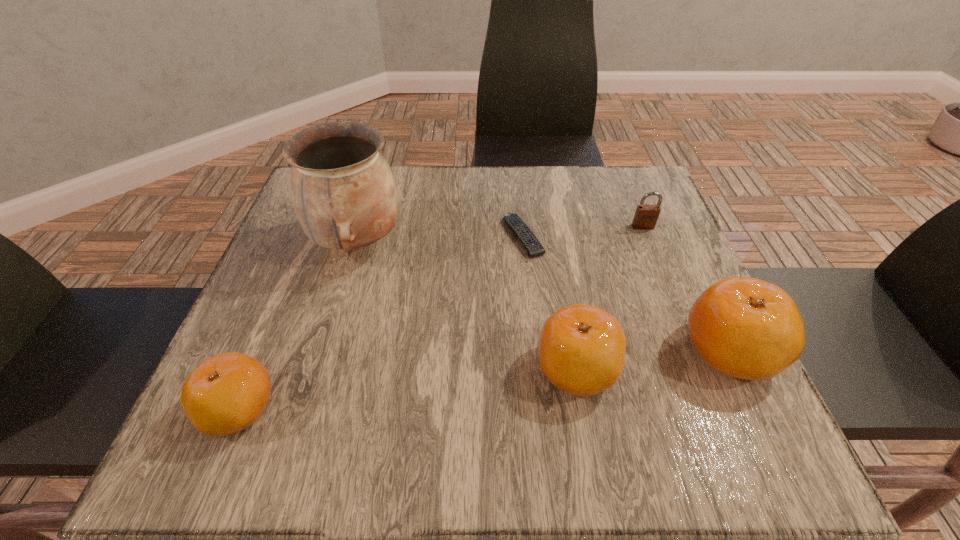
Please determine a free point for an extra clementine to ensure balance. Please provide its 2D coordinates. Your answer should be formatted as a tuple, i.e. [(x, y)], where the tuple contains the x and y coordinates of a point satisfying the conditions above.

[(414, 388)]